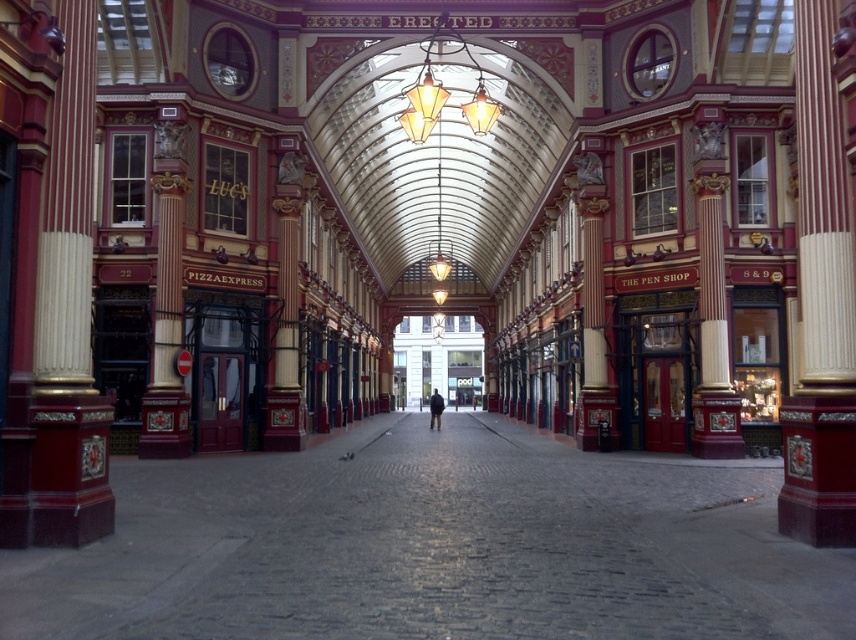
You are a visitor to the arcade and want to take a photo of both the polished red pillar at right and the dark blue jacket at center. Since you want both in the frame, will you need to zoom in or zoom out your camera?

The polished red pillar at right occupies less space than the dark blue jacket at center, so to include both in the frame, you should zoom out to capture the larger dark blue jacket at center while still including the smaller polished red pillar at right.

You are standing in the grand arcade and want to take a photo of the matte gold column at left without any obstructions. Since you need to be at least 8 meters away to capture the entire column in one frame, can you position yourself far enough based on the distance provided?

The matte gold column at left and viewer are 8.45 meters apart from each other. Since 8.45 meters is more than the required 8 meters, you can position yourself far enough to capture the entire column without obstructions.